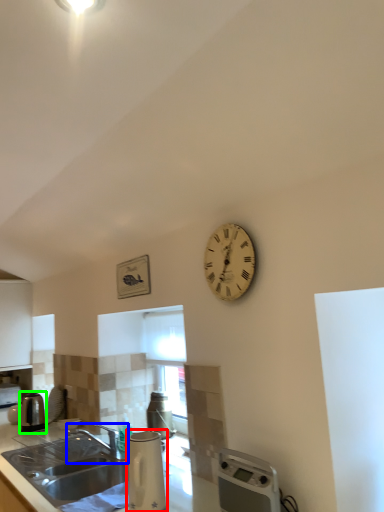
Question: Which is farther away from appliance (highlighted by a red box)? tap (highlighted by a blue box) or kitchen appliance (highlighted by a green box)?

Choices:
 (A) tap
 (B) kitchen appliance

Answer: (B)